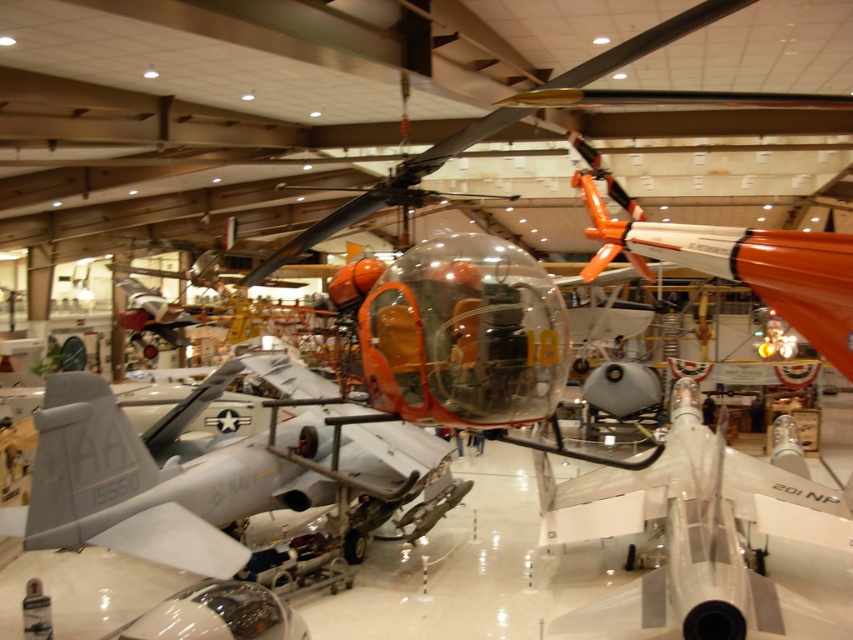
What are the coordinates of `matte gray aircraft at center` in the screenshot? It's located at (218, 470).

Does matte gray aircraft at center have a lesser height compared to white glossy airplane at center?

No, matte gray aircraft at center is not shorter than white glossy airplane at center.

Locate an element on the screen. This screenshot has height=640, width=853. matte gray aircraft at center is located at coordinates (218, 470).